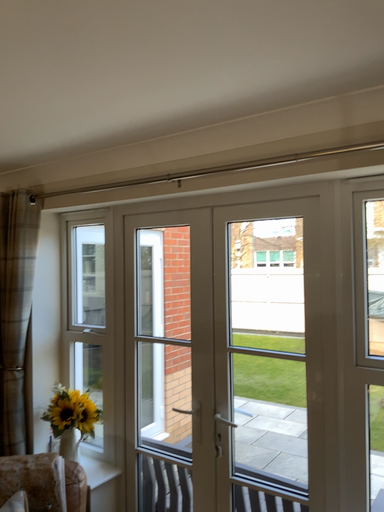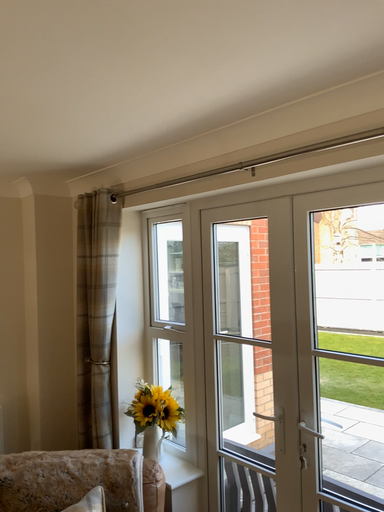
Question: How did the camera likely rotate when shooting the video?

Choices:
 (A) rotated left
 (B) rotated right

Answer: (A)